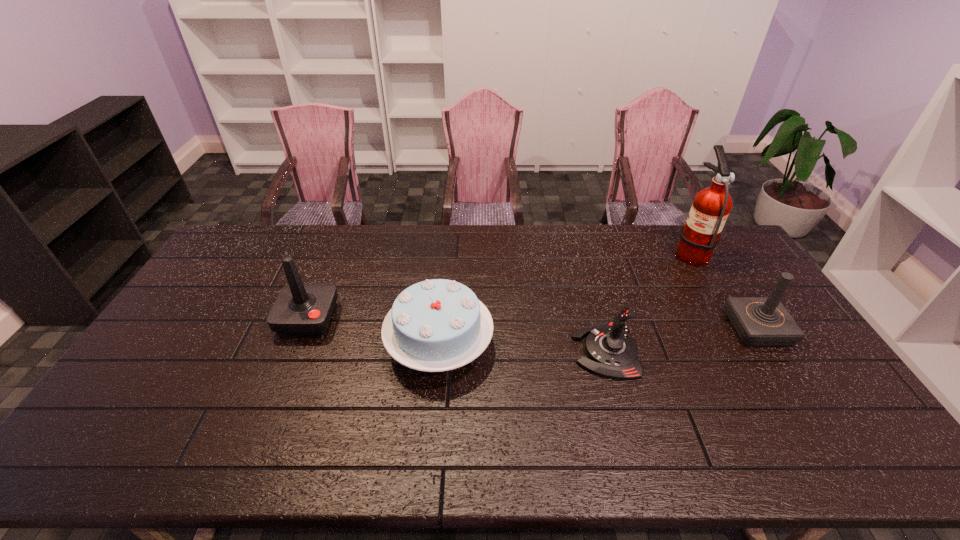
Image resolution: width=960 pixels, height=540 pixels. In order to click on free space between the tallest object and the shortest joystick in this screenshot , I will do (647, 301).

You are a GUI agent. You are given a task and a screenshot of the screen. Output one action in this format:
    pyautogui.click(x=<x>, y=<y>)
    Task: Click on the vacant point located between the leftmost object and the rightmost joystick
    The width and height of the screenshot is (960, 540).
    Given the screenshot: What is the action you would take?
    pyautogui.click(x=533, y=323)

At what (x,y) coordinates should I click in order to perform the action: click on free spot between the leftmost object and the rightmost joystick. Please return your answer as a coordinate pair (x, y). Image resolution: width=960 pixels, height=540 pixels. Looking at the image, I should click on (533, 323).

Where is `vacant space in between the farthest object and the third object from left to right`? The image size is (960, 540). vacant space in between the farthest object and the third object from left to right is located at coordinates (647, 301).

Image resolution: width=960 pixels, height=540 pixels. What are the coordinates of `vacant space in between the shortest joystick and the birthday cake` in the screenshot? It's located at (522, 348).

Find the location of a particular element. This screenshot has height=540, width=960. object that stands as the third closest to the farthest object is located at coordinates (436, 325).

At what (x,y) coordinates should I click in order to perform the action: click on object that stands as the closest to the birthday cake. Please return your answer as a coordinate pair (x, y). This screenshot has width=960, height=540. Looking at the image, I should click on (300, 309).

This screenshot has width=960, height=540. What are the coordinates of `joystick object that ranks as the third closest to the second object from left to right` in the screenshot? It's located at (x=759, y=321).

This screenshot has height=540, width=960. Identify the location of joystick that is the second nearest to the leftmost joystick. (759, 321).

At what (x,y) coordinates should I click in order to perform the action: click on vacant area that satisfies the following two spatial constraints: 1. on the nozzle and handle of the fire extinguisher; 2. on the front side of the birthday cake. Please return your answer as a coordinate pair (x, y). This screenshot has height=540, width=960. Looking at the image, I should click on (744, 345).